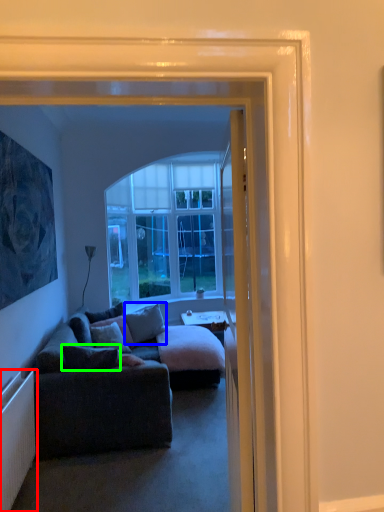
Question: Based on their relative distances, which object is farther from radiator (highlighted by a red box)? Choose from pillow (highlighted by a blue box) and pillow (highlighted by a green box).

Choices:
 (A) pillow
 (B) pillow

Answer: (A)